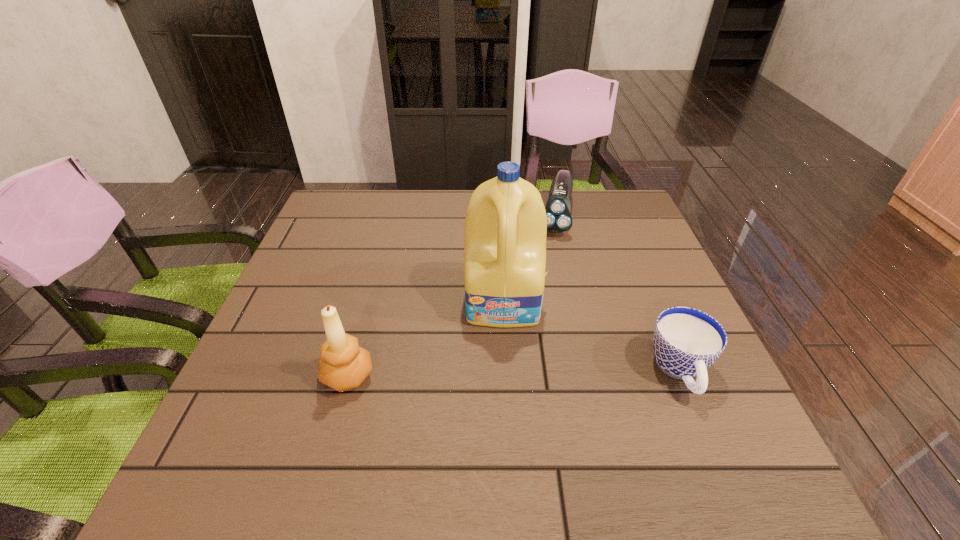
Locate an element on the screen. object that is at the near right corner is located at coordinates (686, 342).

In order to click on free space at the far edge of the desktop in this screenshot , I will do `click(426, 194)`.

Image resolution: width=960 pixels, height=540 pixels. I want to click on vacant region at the near edge of the desktop, so click(441, 408).

This screenshot has width=960, height=540. In order to click on free space at the right edge in this screenshot , I will do `click(619, 293)`.

The width and height of the screenshot is (960, 540). Identify the location of free space at the near left corner of the desktop. (233, 405).

Where is `free region at the far right corner of the desktop`? This screenshot has width=960, height=540. free region at the far right corner of the desktop is located at coordinates (611, 197).

Image resolution: width=960 pixels, height=540 pixels. Find the location of `vacant space at the near right corner of the desktop`. vacant space at the near right corner of the desktop is located at coordinates (702, 400).

The width and height of the screenshot is (960, 540). Find the location of `empty space between the leftmost object and the third object from right to left`. empty space between the leftmost object and the third object from right to left is located at coordinates (426, 339).

This screenshot has height=540, width=960. What are the coordinates of `free area in between the cup and the candle_holder` in the screenshot? It's located at click(x=514, y=374).

What are the coordinates of `vacant space in between the second farthest object and the cup` in the screenshot? It's located at (592, 336).